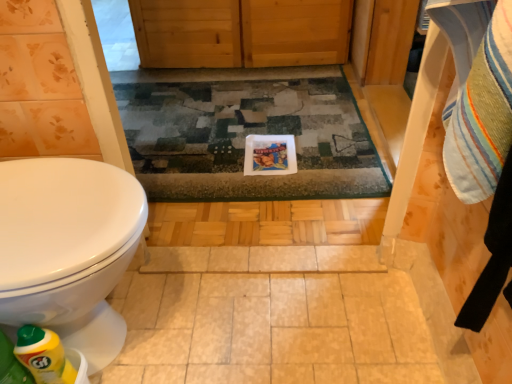
Question: Can we say yellow plastic bottle at lower left lies outside multicolored woven rug at center?

Choices:
 (A) yes
 (B) no

Answer: (A)

Question: Can you confirm if yellow plastic bottle at lower left is wider than multicolored woven rug at center?

Choices:
 (A) yes
 (B) no

Answer: (B)

Question: Is yellow plastic bottle at lower left far from multicolored woven rug at center?

Choices:
 (A) yes
 (B) no

Answer: (A)

Question: Is yellow plastic bottle at lower left touching multicolored woven rug at center?

Choices:
 (A) yes
 (B) no

Answer: (B)

Question: Considering the relative sizes of yellow plastic bottle at lower left and multicolored woven rug at center in the image provided, is yellow plastic bottle at lower left thinner than multicolored woven rug at center?

Choices:
 (A) yes
 (B) no

Answer: (A)

Question: From the image's perspective, is yellow plastic bottle at lower left located beneath multicolored woven rug at center?

Choices:
 (A) no
 (B) yes

Answer: (B)

Question: From the image's perspective, is multicolored woven rug at center beneath yellow plastic bottle at lower left?

Choices:
 (A) yes
 (B) no

Answer: (B)

Question: Is multicolored woven rug at center smaller than yellow plastic bottle at lower left?

Choices:
 (A) no
 (B) yes

Answer: (A)

Question: Could you tell me if multicolored woven rug at center is facing yellow plastic bottle at lower left?

Choices:
 (A) yes
 (B) no

Answer: (B)

Question: Would you say multicolored woven rug at center is outside yellow plastic bottle at lower left?

Choices:
 (A) no
 (B) yes

Answer: (B)

Question: Does multicolored woven rug at center have a greater height compared to yellow plastic bottle at lower left?

Choices:
 (A) no
 (B) yes

Answer: (A)

Question: Considering the relative sizes of multicolored woven rug at center and yellow plastic bottle at lower left in the image provided, is multicolored woven rug at center shorter than yellow plastic bottle at lower left?

Choices:
 (A) no
 (B) yes

Answer: (B)

Question: Based on their positions, is yellow plastic bottle at lower left located to the left or right of multicolored woven rug at center?

Choices:
 (A) left
 (B) right

Answer: (A)